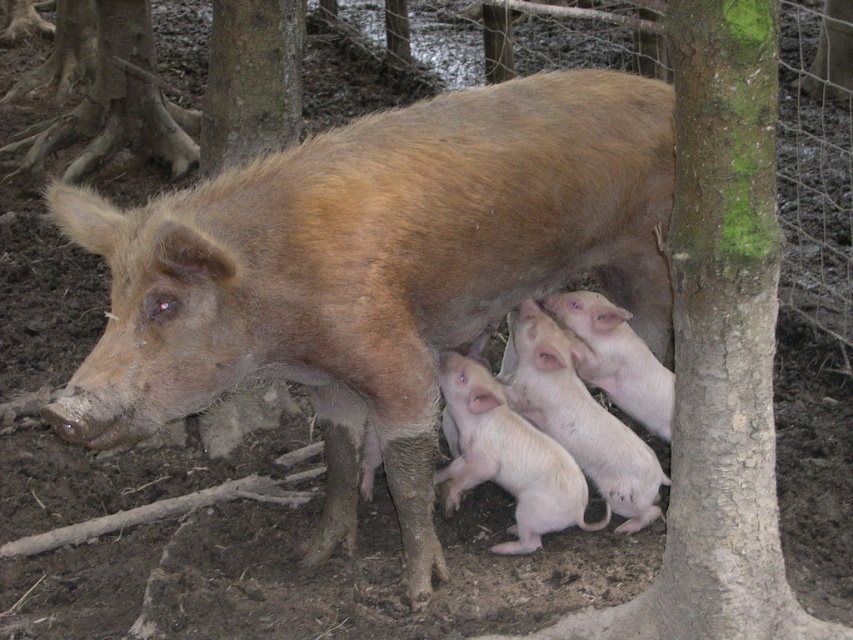
You are a hiker who has just entered the forest and see the brown rough tree trunk at center and the green rough bark at upper center. Which object is closer to the top of the image?

The green rough bark at upper center is closer to the top of the image because it is positioned above the brown rough tree trunk at center.

You are a farmer checking on the piglets. You notice the brown matte piglet at lower center and the smooth pink piglets at center. Which piglet is taller?

The brown matte piglet at lower center is taller than the smooth pink piglets at center.